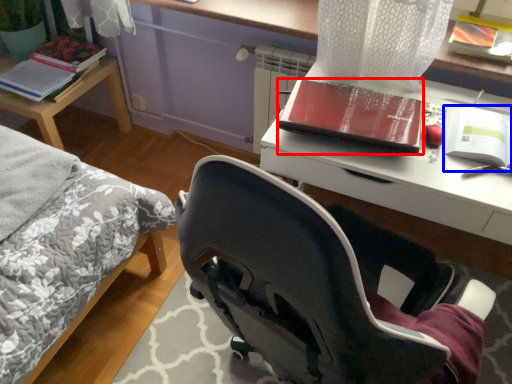
Question: Which object is further to the camera taking this photo, book (highlighted by a red box) or paperback book (highlighted by a blue box)?

Choices:
 (A) book
 (B) paperback book

Answer: (A)